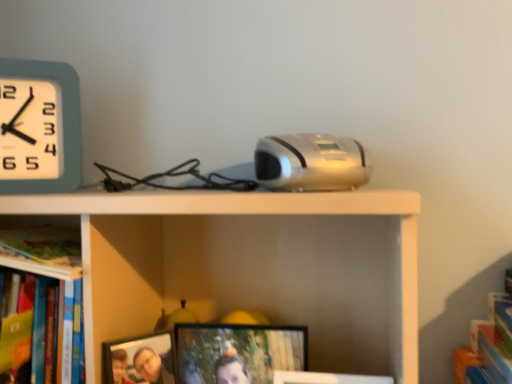
Question: Is the depth of teal plastic wall clock at upper left greater than that of silver metallic projector at center?

Choices:
 (A) yes
 (B) no

Answer: (A)

Question: Considering the relative sizes of teal plastic wall clock at upper left and silver metallic projector at center in the image provided, is teal plastic wall clock at upper left wider than silver metallic projector at center?

Choices:
 (A) yes
 (B) no

Answer: (B)

Question: Does teal plastic wall clock at upper left have a larger size compared to silver metallic projector at center?

Choices:
 (A) no
 (B) yes

Answer: (A)

Question: Does teal plastic wall clock at upper left have a lesser height compared to silver metallic projector at center?

Choices:
 (A) yes
 (B) no

Answer: (B)

Question: Is teal plastic wall clock at upper left positioned beyond the bounds of silver metallic projector at center?

Choices:
 (A) no
 (B) yes

Answer: (B)

Question: Is matte black picture frame at center, which ranks as the first picture frame in right-to-left order, situated inside wooden photo frame at lower center, which appears as the 1th picture frame when viewed from the left, or outside?

Choices:
 (A) outside
 (B) inside

Answer: (A)

Question: Is matte black picture frame at center, the 2th picture frame viewed from the left, in front of or behind wooden photo frame at lower center, which appears as the 1th picture frame when viewed from the left, in the image?

Choices:
 (A) front
 (B) behind

Answer: (B)

Question: Looking at the image, does matte black picture frame at center, which ranks as the first picture frame in right-to-left order, seem bigger or smaller compared to wooden photo frame at lower center, which appears as the 1th picture frame when viewed from the left?

Choices:
 (A) big
 (B) small

Answer: (A)

Question: Is matte black picture frame at center, the 2th picture frame viewed from the left, taller or shorter than wooden photo frame at lower center, which appears as the 1th picture frame when viewed from the left?

Choices:
 (A) short
 (B) tall

Answer: (B)

Question: Is teal plastic wall clock at upper left wider or thinner than silver metallic projector at center?

Choices:
 (A) wide
 (B) thin

Answer: (B)

Question: From a real-world perspective, is teal plastic wall clock at upper left positioned above or below silver metallic projector at center?

Choices:
 (A) below
 (B) above

Answer: (B)

Question: Choose the correct answer: Is teal plastic wall clock at upper left inside silver metallic projector at center or outside it?

Choices:
 (A) outside
 (B) inside

Answer: (A)

Question: Based on their sizes in the image, would you say teal plastic wall clock at upper left is bigger or smaller than silver metallic projector at center?

Choices:
 (A) small
 (B) big

Answer: (A)

Question: Considering the positions of teal plastic wall clock at upper left and wooden photo frame at lower center, which is the 2th picture frame in right-to-left order, in the image, is teal plastic wall clock at upper left bigger or smaller than wooden photo frame at lower center, which is the 2th picture frame in right-to-left order,?

Choices:
 (A) small
 (B) big

Answer: (B)

Question: From the image's perspective, is teal plastic wall clock at upper left above or below wooden photo frame at lower center, which appears as the 1th picture frame when viewed from the left?

Choices:
 (A) below
 (B) above

Answer: (B)